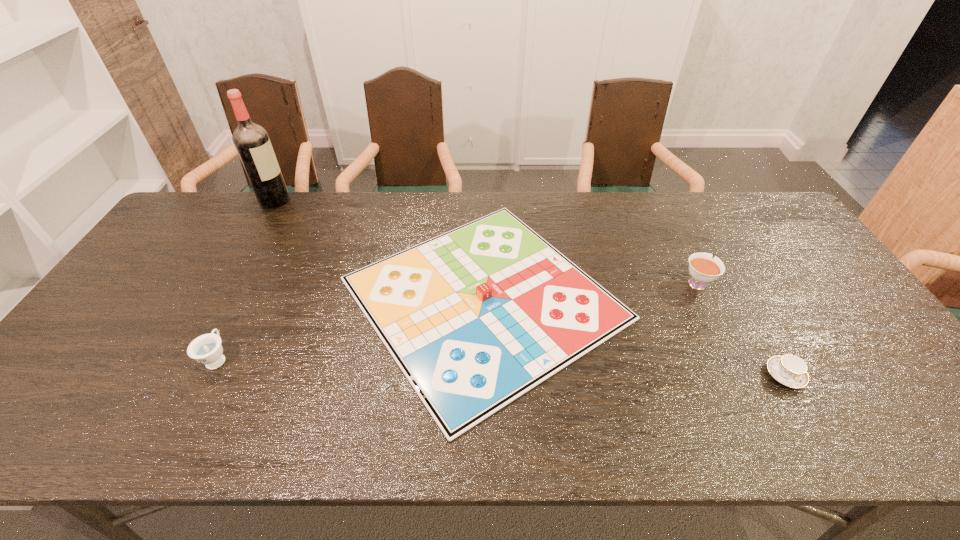
Locate an element on the screen. free region located 0.110m on the side of the second teacup from left to right with the handle is located at coordinates 678,245.

You are a GUI agent. You are given a task and a screenshot of the screen. Output one action in this format:
    pyautogui.click(x=<x>, y=<y>)
    Task: Click on the vacant region located 0.090m on the side of the second teacup from left to right with the handle
    This screenshot has height=540, width=960.
    Given the screenshot: What is the action you would take?
    pyautogui.click(x=681, y=249)

Image resolution: width=960 pixels, height=540 pixels. I want to click on vacant space located on the side of the second teacup from left to right with the handle, so click(671, 231).

At what (x,y) coordinates should I click in order to perform the action: click on vacant space situated on the side of the second shortest teacup with the handle. Please return your answer as a coordinate pair (x, y). The image size is (960, 540). Looking at the image, I should click on (266, 262).

This screenshot has width=960, height=540. I want to click on free space located 0.390m on the side of the second shortest teacup with the handle, so click(276, 242).

The image size is (960, 540). Find the location of `blank space located 0.080m on the side of the second shortest teacup with the handle`. blank space located 0.080m on the side of the second shortest teacup with the handle is located at coordinates point(238,318).

At what (x,y) coordinates should I click in order to perform the action: click on free space located on the side with the handle of the rightmost object. Please return your answer as a coordinate pair (x, y). Image resolution: width=960 pixels, height=540 pixels. Looking at the image, I should click on (805, 411).

Identify the location of vacant point located 0.070m on the back of the gameboard. The width and height of the screenshot is (960, 540). (483, 198).

Where is `liquor at the far edge`? This screenshot has height=540, width=960. liquor at the far edge is located at coordinates (251, 141).

What are the coordinates of `gameboard located in the far edge section of the desktop` in the screenshot? It's located at (475, 317).